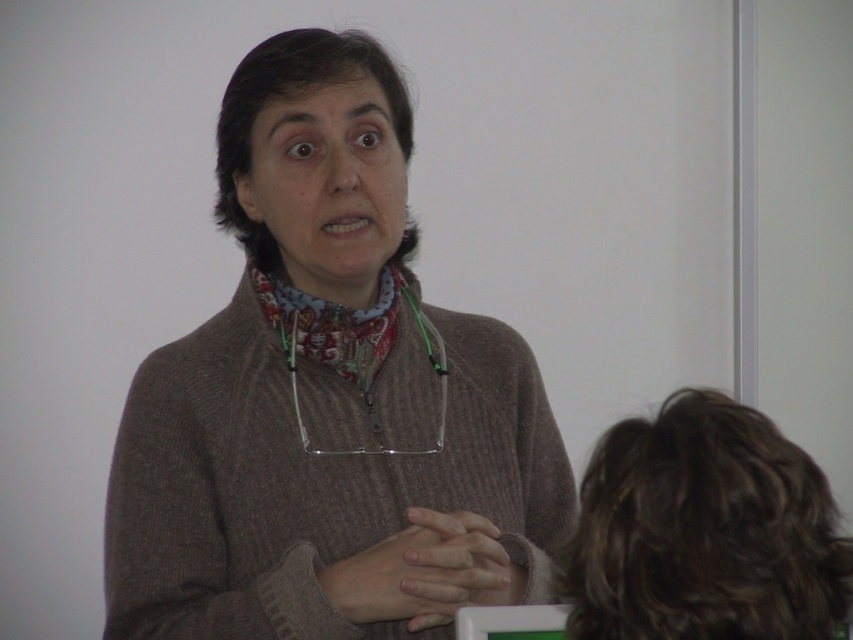
Does point (373, 394) come behind point (433, 513)?

Yes.

I want to click on brown knitted sweater at center, so click(328, 401).

Who is shorter, smooth skin hands at center or patterned fabric at center?

patterned fabric at center is shorter.

Between smooth skin hands at center and patterned fabric at center, which one has more height?

With more height is smooth skin hands at center.

Which is behind, point (477, 584) or point (305, 282)?

The point (305, 282) is more distant.

Identify the location of smooth skin hands at center. (456, 566).

Is point (445, 560) in front of point (263, 284)?

Yes, point (445, 560) is closer to viewer.

Between smooth skin hands at center and printed fabric neckband at center, which one has less height?

Standing shorter between the two is smooth skin hands at center.

Find the location of a particular element. The image size is (853, 640). smooth skin hands at center is located at coordinates (456, 566).

Locate an element on the screen. smooth skin hands at center is located at coordinates (456, 566).